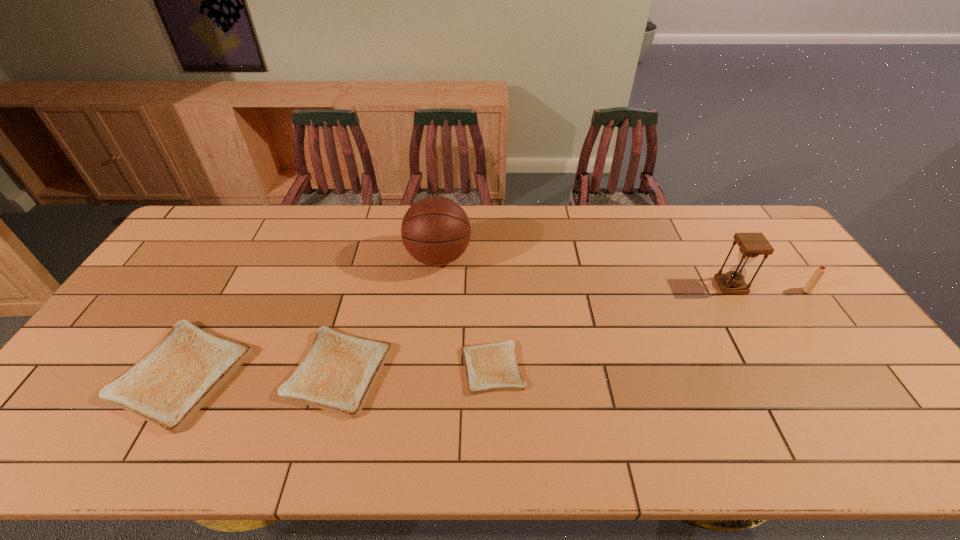
Find the location of `free space that satisfies the following two spatial constraints: 1. on the back side of the tallest object; 2. on the right side of the second shortest toast`. free space that satisfies the following two spatial constraints: 1. on the back side of the tallest object; 2. on the right side of the second shortest toast is located at coordinates (x=369, y=258).